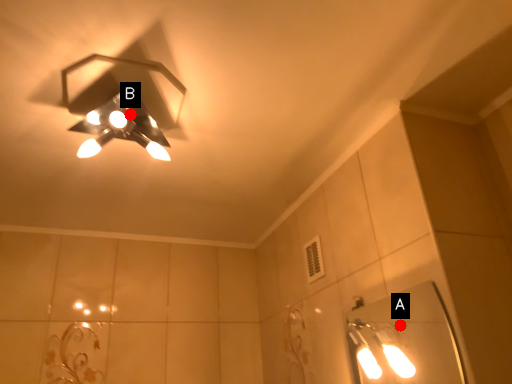
Question: Two points are circled on the image, labeled by A and B beside each circle. Which point is farther from the camera taking this photo?

Choices:
 (A) A is further
 (B) B is further

Answer: (A)